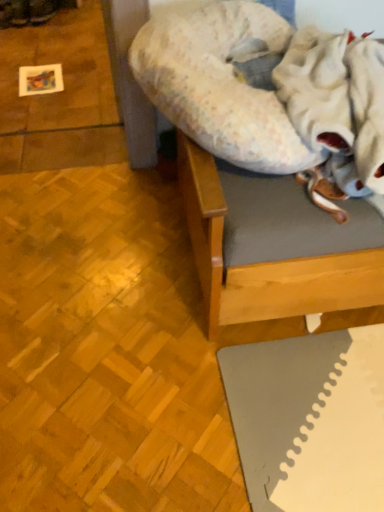
Question: Is wooden bed frame at upper right in front of or behind fluffy white blanket at upper right in the image?

Choices:
 (A) behind
 (B) front

Answer: (A)

Question: Is wooden bed frame at upper right bigger or smaller than fluffy white blanket at upper right?

Choices:
 (A) big
 (B) small

Answer: (A)

Question: Which object is positioned closest to the fluffy white blanket at upper right?

Choices:
 (A) wooden bed frame at upper right
 (B) fluffy fabric dog bed at upper center

Answer: (B)

Question: Which object is positioned farthest from the fluffy white blanket at upper right?

Choices:
 (A) wooden bed frame at upper right
 (B) fluffy fabric dog bed at upper center

Answer: (A)